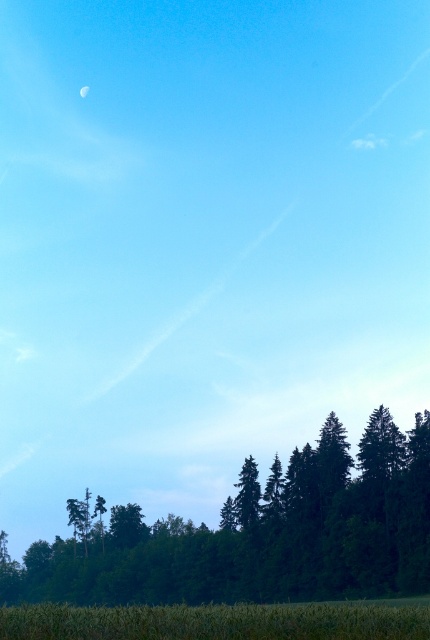
Does green matte tree at lower center have a larger size compared to green grass at bottom?

Yes, green matte tree at lower center is bigger than green grass at bottom.

Between green matte tree at lower center and green grass at bottom, which one has more height?

Standing taller between the two is green matte tree at lower center.

Does point (279, 541) come behind point (192, 637)?

Yes, it is.

The height and width of the screenshot is (640, 430). In order to click on green matte tree at lower center in this screenshot , I will do `click(261, 534)`.